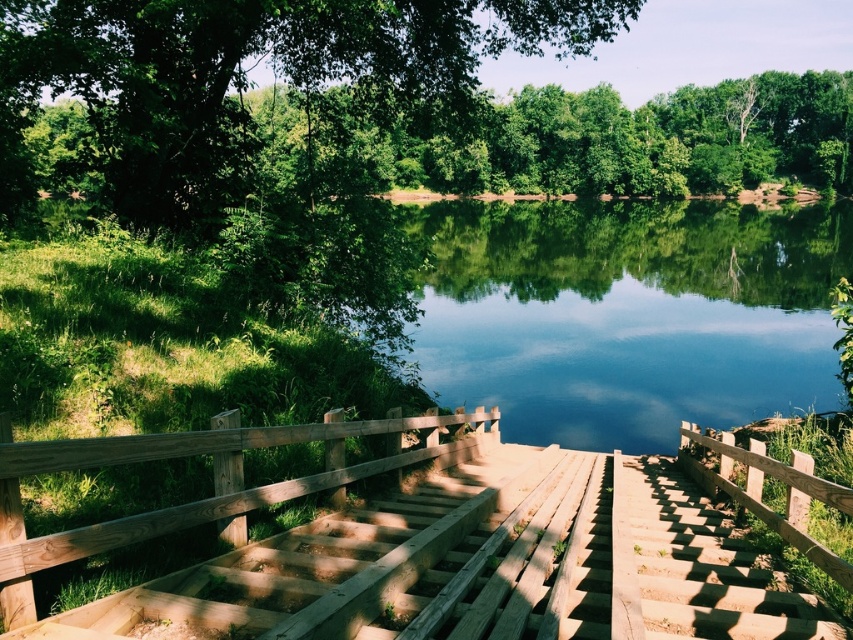
The image size is (853, 640). What are the coordinates of `green smooth water at center` in the screenshot? It's located at (628, 314).

Which is above, green smooth water at center or green leafy tree at upper center?

Positioned higher is green leafy tree at upper center.

This screenshot has width=853, height=640. What are the coordinates of `green smooth water at center` in the screenshot? It's located at (628, 314).

You are a GUI agent. You are given a task and a screenshot of the screen. Output one action in this format:
    pyautogui.click(x=<x>, y=<y>)
    Task: Click on the green smooth water at center
    The height and width of the screenshot is (640, 853).
    Given the screenshot: What is the action you would take?
    pyautogui.click(x=628, y=314)

Does wooden bridge at center have a smaller size compared to wooden stairs at center?

No, wooden bridge at center is not smaller than wooden stairs at center.

In the scene shown: Who is more forward, (372,554) or (689,600)?

Point (689,600) is in front.

Locate an element on the screen. wooden bridge at center is located at coordinates click(437, 554).

Who is positioned more to the left, green leafy tree at upper center or wooden rail at center?

From the viewer's perspective, green leafy tree at upper center appears more on the left side.

Which is more to the right, green leafy tree at upper center or wooden rail at center?

From the viewer's perspective, wooden rail at center appears more on the right side.

Does point (9, 4) come behind point (682, 428)?

No, (9, 4) is closer to viewer.

Find the location of a particular element. The height and width of the screenshot is (640, 853). green leafy tree at upper center is located at coordinates (244, 74).